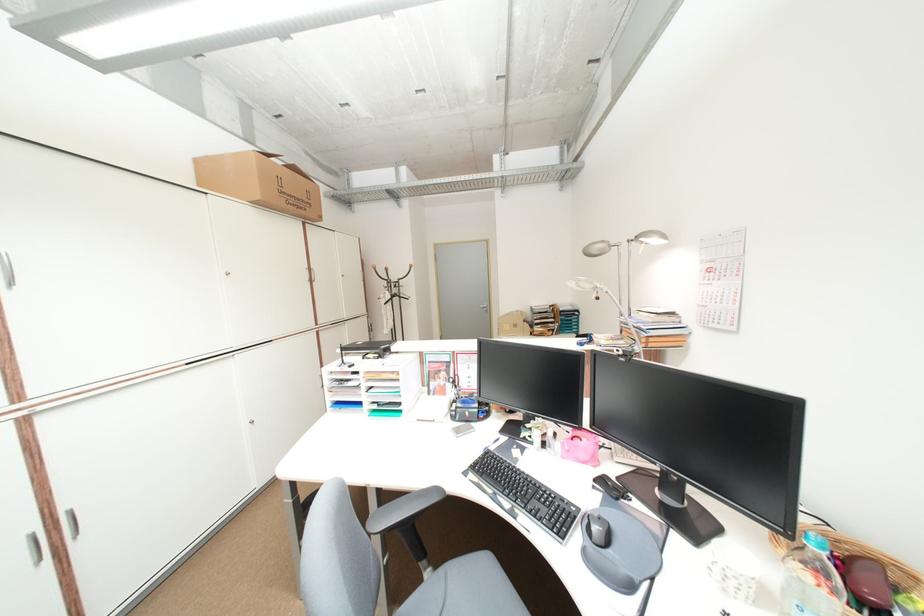
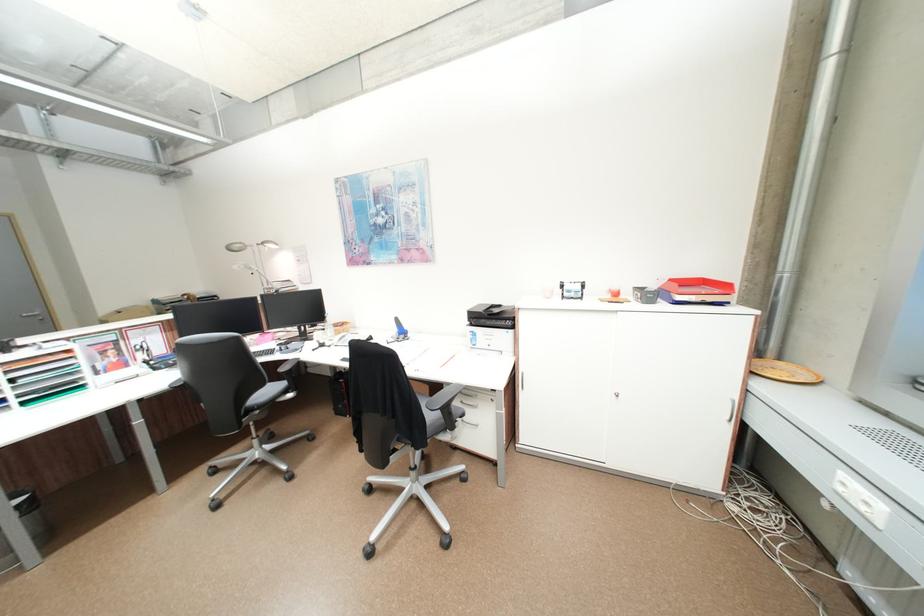
Where in the second image is the point corresponding to pixel 662 241 from the first image?

(281, 246)